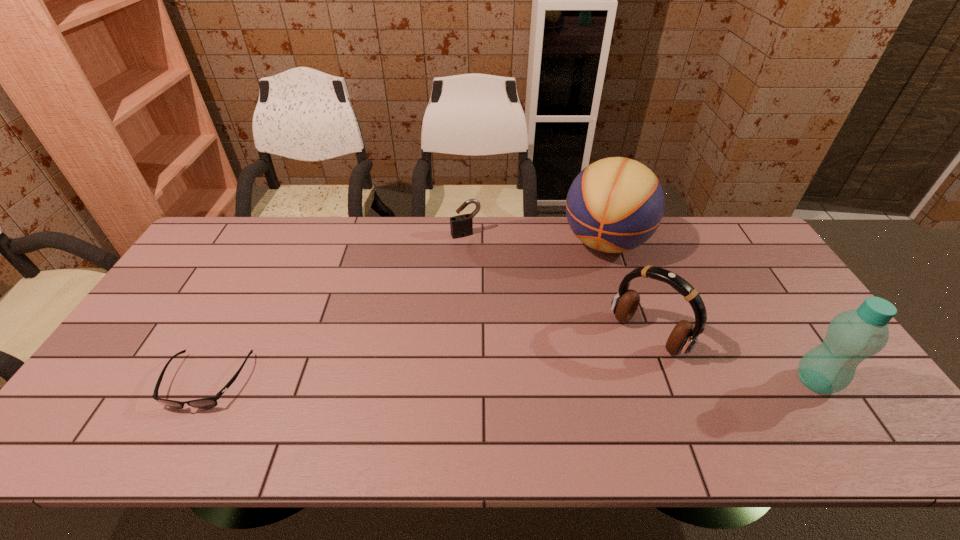
What are the coordinates of `bottle located in the near edge section of the desktop` in the screenshot? It's located at (852, 336).

In order to click on object that is at the left edge in this screenshot , I will do `click(205, 403)`.

Identify the location of object that is at the right edge. Image resolution: width=960 pixels, height=540 pixels. (852, 336).

The width and height of the screenshot is (960, 540). In order to click on object that is at the near left corner in this screenshot , I will do (205, 403).

Where is `object at the near right corner`? The height and width of the screenshot is (540, 960). object at the near right corner is located at coordinates (852, 336).

The width and height of the screenshot is (960, 540). In the image, there is a desktop. Identify the location of vacant space at the far edge. (567, 225).

The width and height of the screenshot is (960, 540). Find the location of `vacant area at the near edge of the desktop`. vacant area at the near edge of the desktop is located at coordinates (387, 381).

Where is `vacant space at the left edge of the desktop`? vacant space at the left edge of the desktop is located at coordinates (222, 271).

The width and height of the screenshot is (960, 540). What are the coordinates of `free region at the right edge of the desktop` in the screenshot? It's located at (782, 287).

The width and height of the screenshot is (960, 540). In the image, there is a desktop. In order to click on vacant space at the near left corner in this screenshot , I will do `click(150, 410)`.